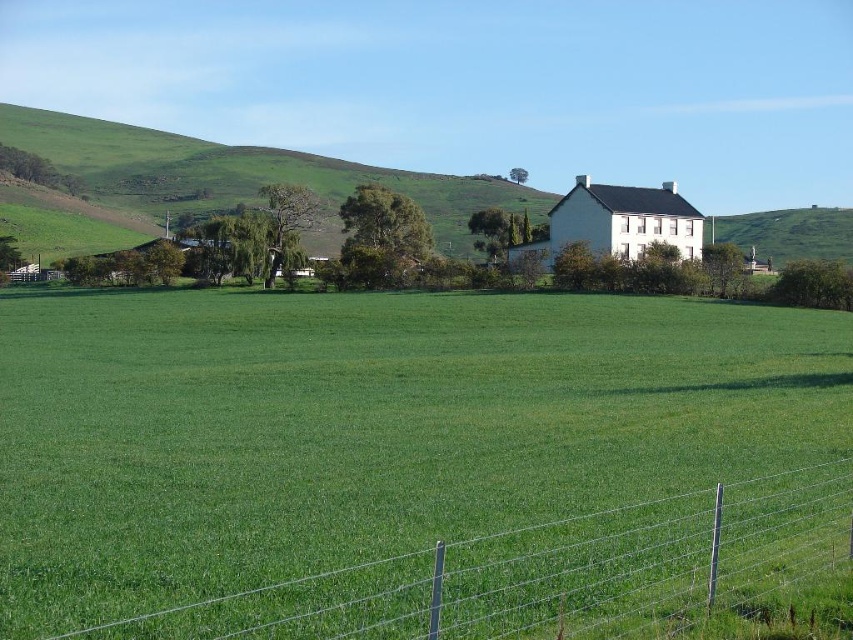
Describe the element at coordinates (364, 424) in the screenshot. This screenshot has width=853, height=640. I see `green grass field at center` at that location.

Which is in front, point (730, 440) or point (109, 193)?

Point (730, 440) is in front.

Between point (683, 458) and point (338, 170), which one is positioned behind?

The point (338, 170) is behind.

Locate an element on the screen. The height and width of the screenshot is (640, 853). green grass field at center is located at coordinates (364, 424).

Who is shorter, wire mesh fence at lower right or green grassy hillside at upper left?

With less height is wire mesh fence at lower right.

Looking at this image, does wire mesh fence at lower right have a lesser height compared to green grassy hillside at upper left?

Indeed, wire mesh fence at lower right has a lesser height compared to green grassy hillside at upper left.

You are a GUI agent. You are given a task and a screenshot of the screen. Output one action in this format:
    pyautogui.click(x=<x>, y=<y>)
    Task: Click on the wire mesh fence at lower right
    This screenshot has width=853, height=640.
    Given the screenshot: What is the action you would take?
    pyautogui.click(x=550, y=572)

Does green grass field at center appear on the right side of wire mesh fence at lower right?

Yes, green grass field at center is to the right of wire mesh fence at lower right.

Is point (490, 381) less distant than point (318, 593)?

No, (490, 381) is behind (318, 593).

You are a GUI agent. You are given a task and a screenshot of the screen. Output one action in this format:
    pyautogui.click(x=<x>, y=<y>)
    Task: Click on the green grass field at center
    
    Given the screenshot: What is the action you would take?
    pyautogui.click(x=364, y=424)